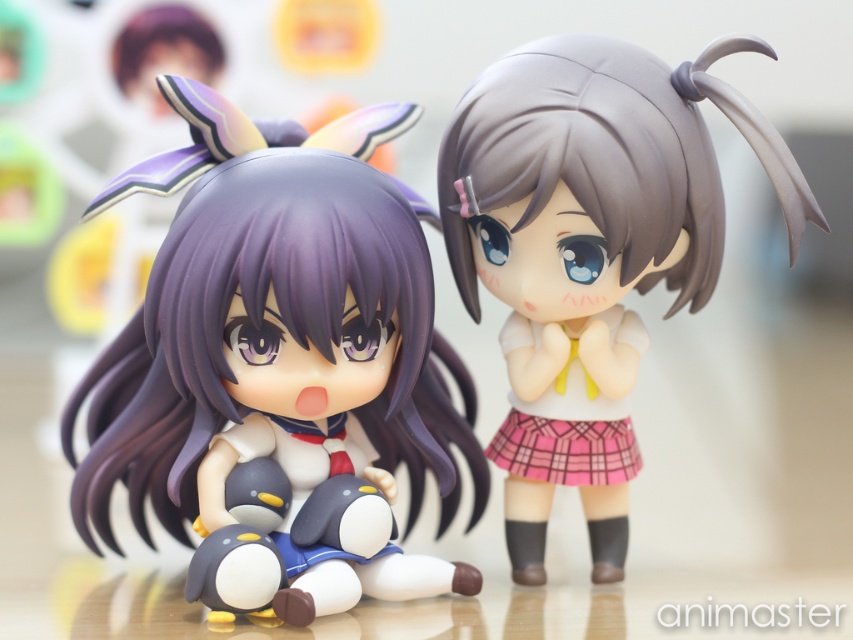
You are an animator trying to position two figurines on a desk. The first figurine is holding two small penguin figurines and has butterfly accessories on her head. The second figurine is located at point (206, 141). If you need to place a third figurine exactly halfway between them, where should you place it?

The third figurine should be placed at the midpoint between the two existing figurines. Since they are 3.57 feet apart, the midpoint would be 1.785 feet from each. However, without specific coordinate values for the first figurine, an exact coordinate cannot be calculated. The answer focuses on the relative distance rather than absolute coordinates.

You are an animator working on a scene where you need to place a spotlight. You need to determine which of the two points, point (250, 358) or point (521, 253), is closer to the camera to ensure proper lighting. Based on the image, which point is closer?

Point (250, 358) is closer to the camera than point (521, 253) because it is in front of it according to the description.

Consider the image. You are an interior designer arranging these two dolls on a shelf. The satin purple doll at center and the satin gray doll at center need to be placed in a way that the shorter one is closer to the front for visibility. Which doll should be positioned at the front?

The satin purple doll at center should be placed at the front since it is shorter than the satin gray doll at center, ensuring it remains visible over the taller one.